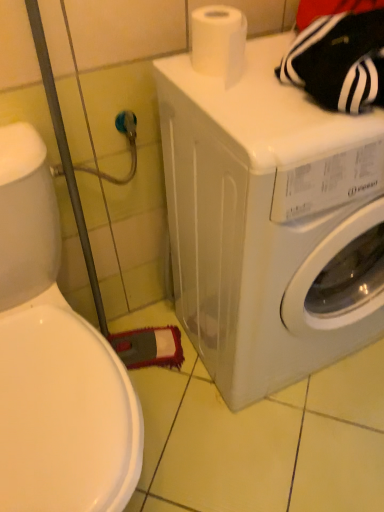
Question: In the image, is white matte toilet paper at upper center positioned in front of or behind white plastic washing machine at center?

Choices:
 (A) front
 (B) behind

Answer: (B)

Question: Do you think white matte toilet paper at upper center is within white plastic washing machine at center, or outside of it?

Choices:
 (A) inside
 (B) outside

Answer: (B)

Question: Visually, is white matte toilet paper at upper center positioned to the left or to the right of white plastic washing machine at center?

Choices:
 (A) left
 (B) right

Answer: (A)

Question: Is white plastic washing machine at center bigger or smaller than white matte toilet paper at upper center?

Choices:
 (A) small
 (B) big

Answer: (B)

Question: From the image's perspective, is white plastic washing machine at center above or below white matte toilet paper at upper center?

Choices:
 (A) below
 (B) above

Answer: (A)

Question: From a real-world perspective, is white plastic washing machine at center above or below white matte toilet paper at upper center?

Choices:
 (A) below
 (B) above

Answer: (A)

Question: Considering the positions of white plastic washing machine at center and white matte toilet paper at upper center in the image, is white plastic washing machine at center wider or thinner than white matte toilet paper at upper center?

Choices:
 (A) thin
 (B) wide

Answer: (B)